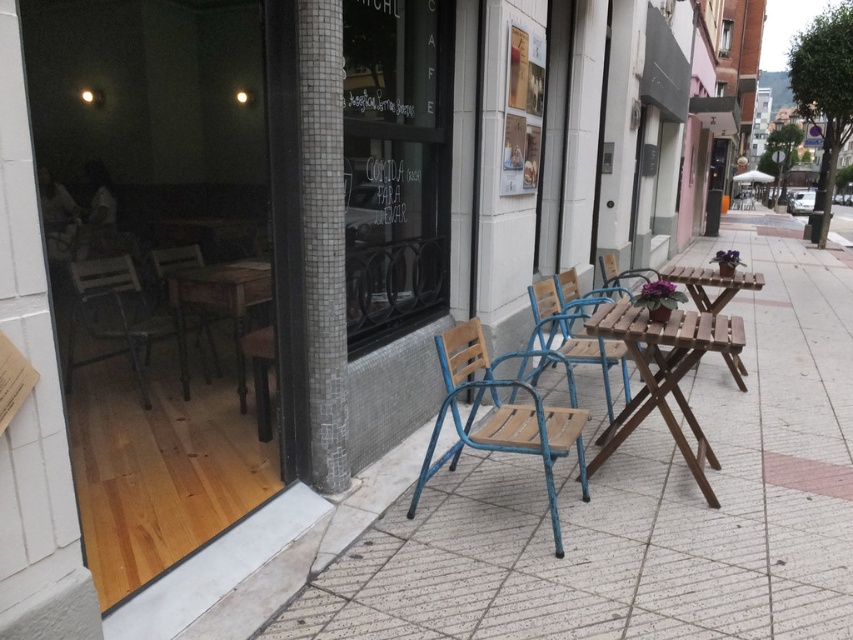
Describe the element at coordinates (573, 333) in the screenshot. The width and height of the screenshot is (853, 640). I see `wooden chair at center` at that location.

Can you confirm if wooden chair at center is wider than metallic brown chair at left?

Indeed, wooden chair at center has a greater width compared to metallic brown chair at left.

This screenshot has width=853, height=640. I want to click on wooden chair at center, so click(x=573, y=333).

Identify the location of wooden chair at center. The height and width of the screenshot is (640, 853). (573, 333).

Is wooden pavement at center bigger than blue metal chair at center?

Correct, wooden pavement at center is larger in size than blue metal chair at center.

Can you confirm if wooden pavement at center is positioned to the right of blue metal chair at center?

Indeed, wooden pavement at center is positioned on the right side of blue metal chair at center.

Is point (721, 576) closer to camera compared to point (459, 429)?

That is True.

Identify the location of wooden pavement at center. This screenshot has width=853, height=640. pos(643,502).

Is point (648, 324) positioned before point (146, 323)?

Yes, it is.

Which is in front, point (672, 432) or point (108, 262)?

Point (672, 432) is in front.

Between point (669, 412) and point (93, 308), which one is positioned behind?

Point (93, 308)

This screenshot has height=640, width=853. I want to click on brown wooden table at center, so click(664, 372).